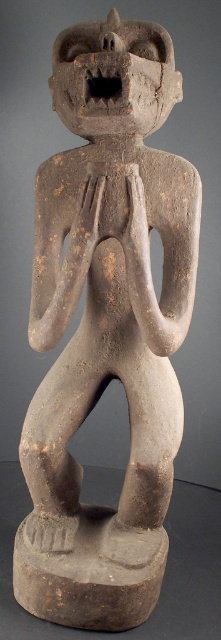
Locate an element on the screen. The width and height of the screenshot is (221, 640). brown clay hand at center is located at coordinates (87, 211).

I want to click on brown clay hand at center, so click(87, 211).